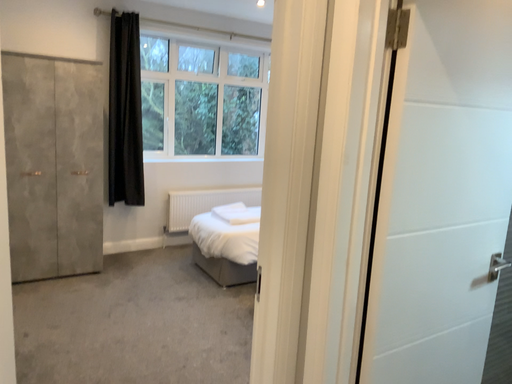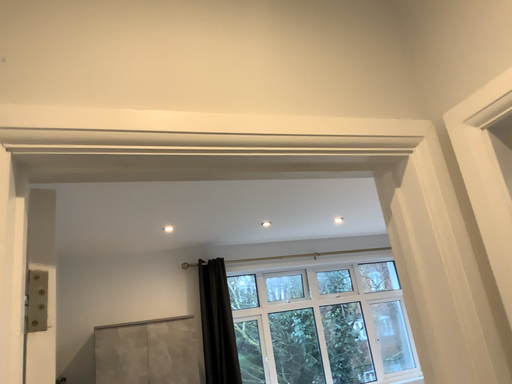
Question: Which way did the camera rotate in the video?

Choices:
 (A) rotated right
 (B) rotated left

Answer: (B)